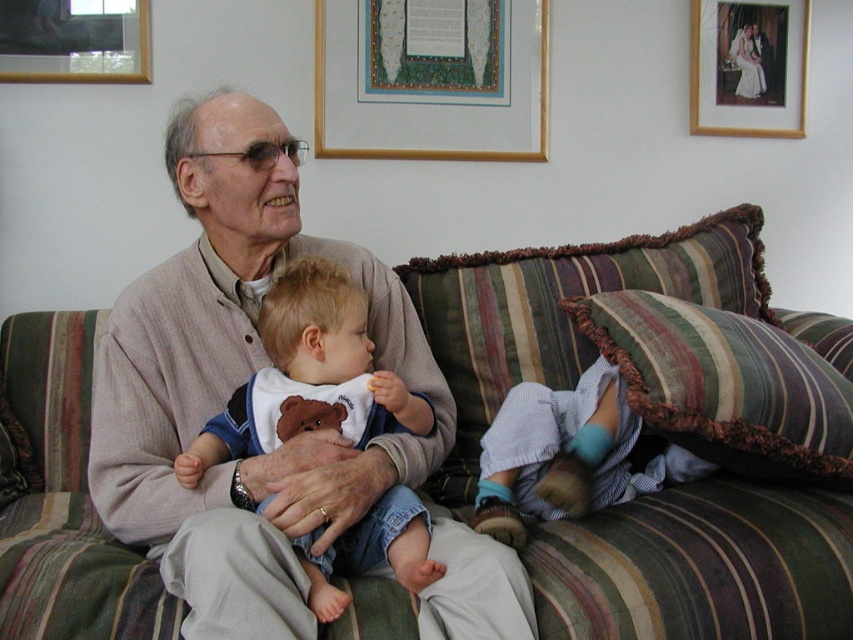
Between striped fabric couch at center and gold-framed picture at upper center, which one has more height?

With more height is striped fabric couch at center.

Can you confirm if striped fabric couch at center is shorter than gold-framed picture at upper center?

In fact, striped fabric couch at center may be taller than gold-framed picture at upper center.

Who is more distant from viewer, (515, 371) or (363, 120)?

The point (363, 120) is behind.

I want to click on striped fabric couch at center, so click(706, 554).

Does gold-framed picture at upper center appear under wooden picture frame at upper right?

Yes, gold-framed picture at upper center is below wooden picture frame at upper right.

Is point (357, 134) in front of point (762, 45)?

Yes.

Between point (515, 157) and point (792, 93), which one is positioned behind?

Positioned behind is point (792, 93).

Identify the location of gold-framed picture at upper center. (431, 80).

Who is positioned more to the left, gold-framed picture at upper center or brushed metal picture frame at upper left?

Positioned to the left is brushed metal picture frame at upper left.

Is gold-framed picture at upper center smaller than brushed metal picture frame at upper left?

Incorrect, gold-framed picture at upper center is not smaller in size than brushed metal picture frame at upper left.

The height and width of the screenshot is (640, 853). Find the location of `gold-framed picture at upper center`. gold-framed picture at upper center is located at coordinates (431, 80).